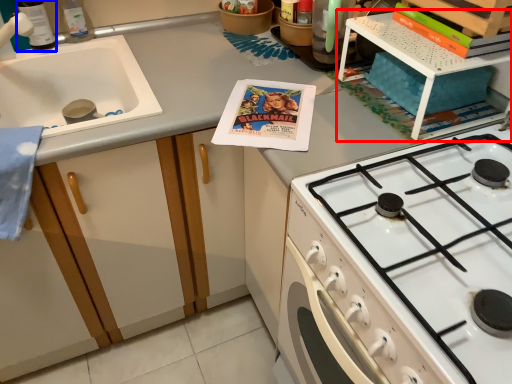
Question: Which point is further to the camera, shelf (highlighted by a red box) or bottle (highlighted by a blue box)?

Choices:
 (A) shelf
 (B) bottle

Answer: (B)